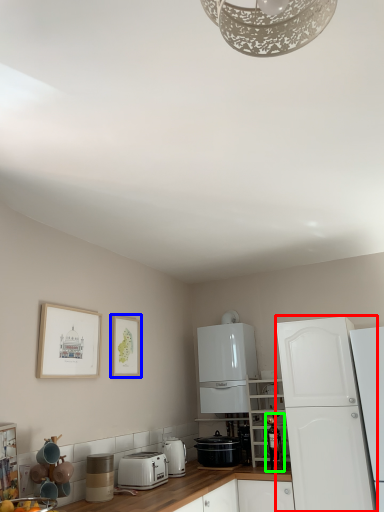
Question: Which object is positioned farthest from cabinetry (highlighted by a red box)? Select from picture frame (highlighted by a blue box) and appliance (highlighted by a green box).

Choices:
 (A) picture frame
 (B) appliance

Answer: (A)